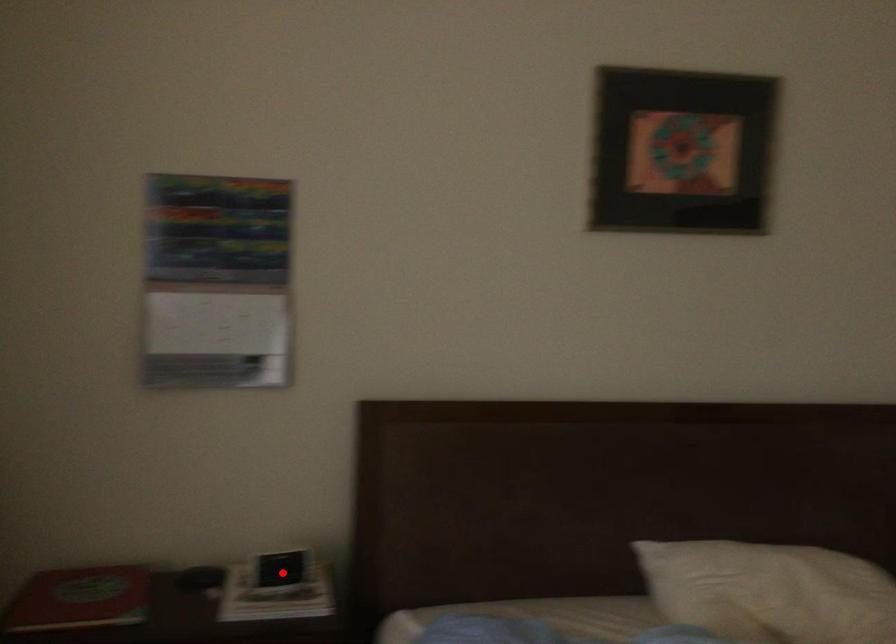
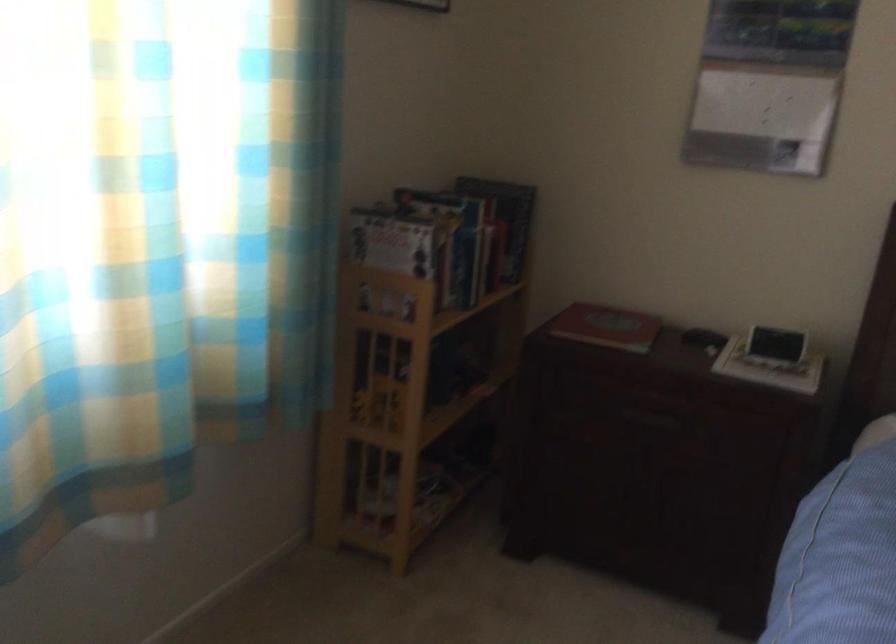
Where in the second image is the point corresponding to the highlighted location from the first image?

(776, 344)